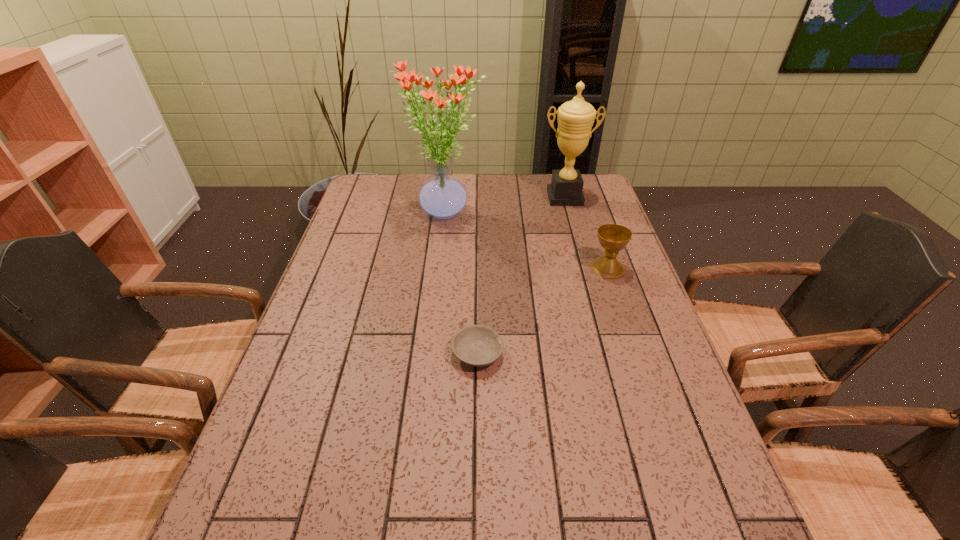
I want to click on vacant space that's between the shortest object and the third farthest object, so coord(542,310).

Find the location of a particular element. free space between the flower arrangement and the chalice is located at coordinates (526, 241).

Find the location of a particular element. Image resolution: width=960 pixels, height=540 pixels. vacant space that's between the flower arrangement and the bowl is located at coordinates (461, 284).

The image size is (960, 540). In order to click on free space that is in between the tallest object and the second nearest object in this screenshot , I will do `click(526, 241)`.

I want to click on empty space between the third shortest object and the second nearest object, so click(587, 233).

You are a GUI agent. You are given a task and a screenshot of the screen. Output one action in this format:
    pyautogui.click(x=<x>, y=<y>)
    Task: Click on the vacant space that's between the flower arrangement and the third tallest object
    This screenshot has height=540, width=960.
    Given the screenshot: What is the action you would take?
    pyautogui.click(x=526, y=241)

This screenshot has height=540, width=960. Find the location of `unoccupied area between the trophy cup and the third farthest object`. unoccupied area between the trophy cup and the third farthest object is located at coordinates (587, 233).

Where is `free space that is in between the third tallest object and the nearest object`? Image resolution: width=960 pixels, height=540 pixels. free space that is in between the third tallest object and the nearest object is located at coordinates (542, 310).

Locate an element on the screen. The image size is (960, 540). free spot between the third shortest object and the nearest object is located at coordinates (521, 276).

Identify which object is located as the third nearest to the bowl. Please provide its 2D coordinates. Your answer should be formatted as a tuple, i.e. [(x, y)], where the tuple contains the x and y coordinates of a point satisfying the conditions above.

[(576, 117)]